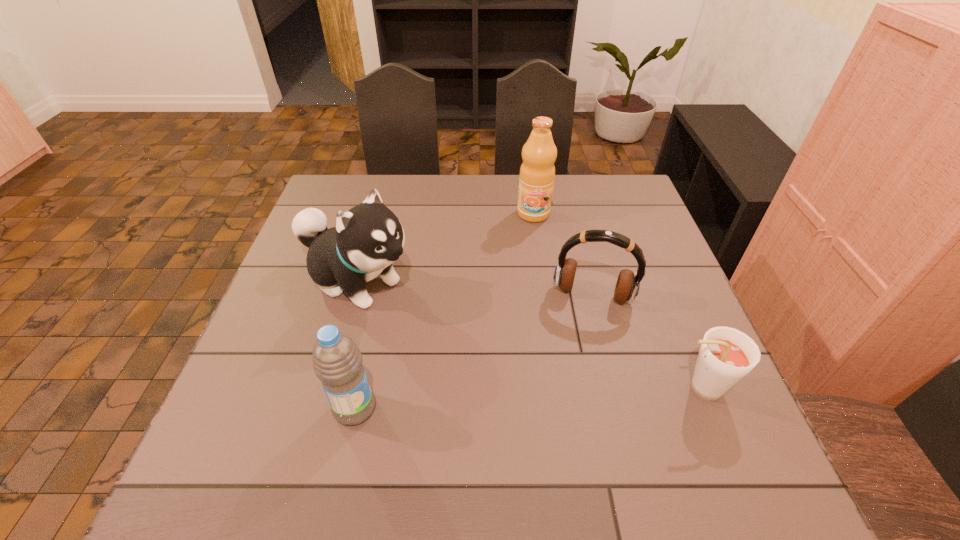
This screenshot has height=540, width=960. What are the coordinates of `root beer that is positioned at the near edge` in the screenshot? It's located at (727, 355).

In order to click on object that is at the left edge in this screenshot , I will do (x=368, y=238).

Find the location of a particular element. The height and width of the screenshot is (540, 960). root beer at the right edge is located at coordinates (727, 355).

Locate an element on the screen. This screenshot has height=540, width=960. headset located in the right edge section of the desktop is located at coordinates (627, 286).

Find the location of a particular element. object that is at the near right corner is located at coordinates (727, 355).

Where is `vacant space at the far edge of the desktop`? The width and height of the screenshot is (960, 540). vacant space at the far edge of the desktop is located at coordinates (381, 176).

In the image, there is a desktop. At what (x,y) coordinates should I click in order to perform the action: click on free space at the near edge. Please return your answer as a coordinate pair (x, y). Looking at the image, I should click on (530, 408).

You are a GUI agent. You are given a task and a screenshot of the screen. Output one action in this format:
    pyautogui.click(x=<x>, y=<y>)
    Task: Click on the free spot at the left edge of the desktop
    Image resolution: width=960 pixels, height=540 pixels.
    Given the screenshot: What is the action you would take?
    pyautogui.click(x=294, y=328)

The height and width of the screenshot is (540, 960). In the image, there is a desktop. Identify the location of blank space at the right edge. (668, 359).

In the image, there is a desktop. Where is `vacant space at the far left corner`? vacant space at the far left corner is located at coordinates (360, 199).